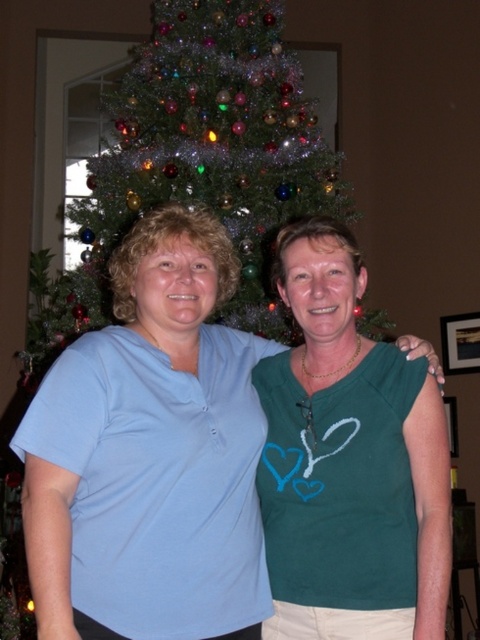
Does light blue cotton shirt at center appear on the left side of green glittery christmas tree at center?

Incorrect, light blue cotton shirt at center is not on the left side of green glittery christmas tree at center.

Does point (148, 362) lie in front of point (269, 308)?

That is True.

Where is `light blue cotton shirt at center`? light blue cotton shirt at center is located at coordinates (151, 452).